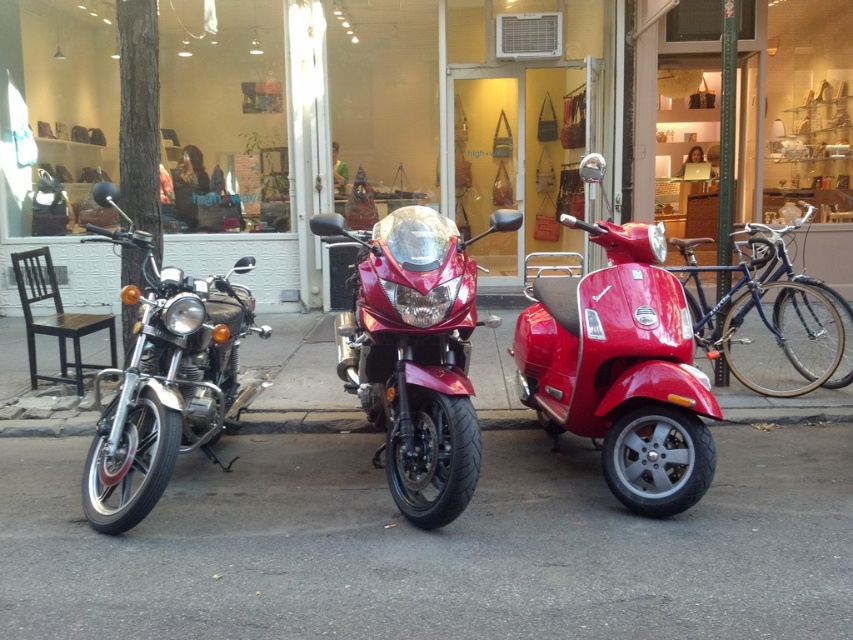
Can you confirm if matte black motorcycle at left is wider than glossy red motorcycle at center?

Yes.

Is matte black motorcycle at left thinner than glossy red motorcycle at center?

No.

Does point (73, 60) lie behind point (392, 497)?

Yes, point (73, 60) is farther from viewer.

At what (x,y) coordinates should I click in order to perform the action: click on matte black motorcycle at left. Please return your answer as a coordinate pair (x, y). This screenshot has width=853, height=640. Looking at the image, I should click on (222, 116).

Can you confirm if black asphalt at center is positioned to the left of glossy red motorcycle at center?

In fact, black asphalt at center is to the right of glossy red motorcycle at center.

Can you confirm if black asphalt at center is thinner than glossy red motorcycle at center?

Incorrect, black asphalt at center's width is not less than glossy red motorcycle at center's.

Find the location of `black asphalt at center`. black asphalt at center is located at coordinates (434, 547).

Find the location of `black asphalt at center`. black asphalt at center is located at coordinates (434, 547).

This screenshot has width=853, height=640. What do you see at coordinates (621, 369) in the screenshot? I see `shiny red scooter at center` at bounding box center [621, 369].

Does shiny red scooter at center have a lesser height compared to glossy red motorcycle at center?

Yes, shiny red scooter at center is shorter than glossy red motorcycle at center.

Is point (607, 452) less distant than point (396, 497)?

No, it is behind (396, 497).

Locate an element on the screen. Image resolution: width=853 pixels, height=640 pixels. shiny red scooter at center is located at coordinates (621, 369).